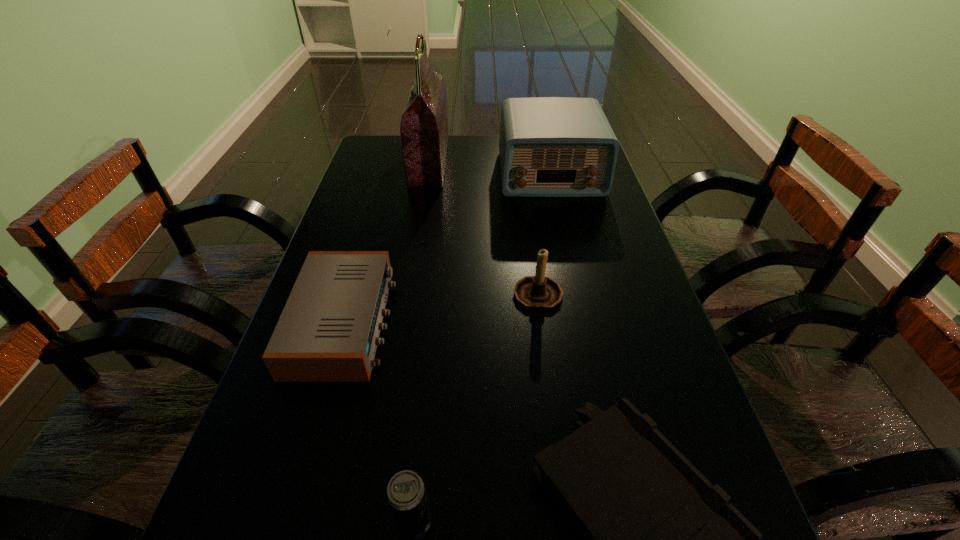
I want to click on free point between the fourth tallest object and the nearer radio receiver, so click(x=378, y=421).

You are a GUI agent. You are given a task and a screenshot of the screen. Output one action in this format:
    pyautogui.click(x=<x>, y=<y>)
    Task: Click on the vacant area between the nearer radio receiver and the beer can
    This screenshot has height=540, width=960.
    Given the screenshot: What is the action you would take?
    pyautogui.click(x=378, y=421)

Find the location of a particular element. This screenshot has width=960, height=540. free spot between the right radio receiver and the nearer radio receiver is located at coordinates (447, 248).

You are a GUI agent. You are given a task and a screenshot of the screen. Output one action in this format:
    pyautogui.click(x=<x>, y=<y>)
    Task: Click on the empty space that is in between the taller radio receiver and the candle holder
    Image resolution: width=960 pixels, height=540 pixels.
    Given the screenshot: What is the action you would take?
    pyautogui.click(x=543, y=232)

The image size is (960, 540). What are the coordinates of `empty space that is in between the shorter radio receiver and the third tallest object` in the screenshot? It's located at (441, 307).

Where is `free space between the candle holder and the tallest object`? The height and width of the screenshot is (540, 960). free space between the candle holder and the tallest object is located at coordinates (484, 226).

This screenshot has width=960, height=540. I want to click on vacant area between the beer can and the shorter radio receiver, so click(x=378, y=421).

This screenshot has width=960, height=540. Identify the location of vacant space that's between the third tallest object and the farther radio receiver. (543, 232).

Locate an element on the screen. unoccupied position between the beer can and the farther radio receiver is located at coordinates (482, 346).

The height and width of the screenshot is (540, 960). What are the coordinates of `object that stands as the fourth closest to the left radio receiver` in the screenshot? It's located at (424, 134).